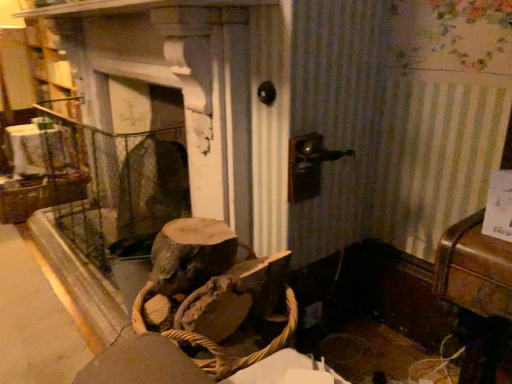
Where is `polished brass door handle at center right`? polished brass door handle at center right is located at coordinates (308, 165).

What is the approximate width of polished brass door handle at center right?

5.60 inches.

The width and height of the screenshot is (512, 384). Describe the element at coordinates (308, 165) in the screenshot. I see `polished brass door handle at center right` at that location.

Where is `polished brass door handle at center right`? The height and width of the screenshot is (384, 512). polished brass door handle at center right is located at coordinates (308, 165).